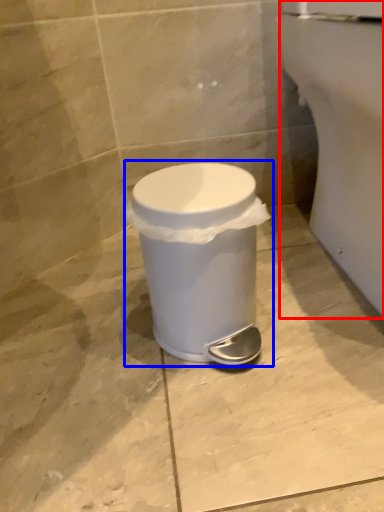
Question: Which of the following is the farthest to the observer, porcelain (highlighted by a red box) or waste container (highlighted by a blue box)?

Choices:
 (A) porcelain
 (B) waste container

Answer: (B)